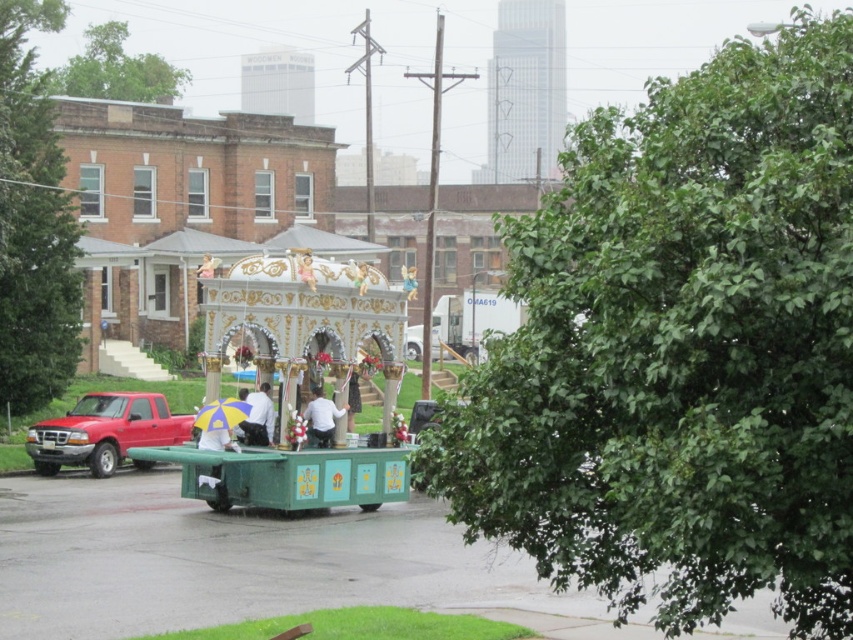
Question: From the image, what is the correct spatial relationship of green leafy tree at left in relation to white matte shirt at center?

Choices:
 (A) below
 (B) above

Answer: (B)

Question: Which of these objects is positioned closest to the gold metallic statue at center?

Choices:
 (A) matte red truck at left
 (B) golden ornate angel at center

Answer: (B)

Question: Among these points, which one is nearest to the camera?

Choices:
 (A) [363, 486]
 (B) [457, 326]

Answer: (A)

Question: Among these objects, which one is nearest to the camera?

Choices:
 (A) white glossy truck at center
 (B) white matte shirt at center
 (C) green painted wood cart at center

Answer: (A)

Question: Is green leafy tree at center below white matte shirt at center?

Choices:
 (A) yes
 (B) no

Answer: (B)

Question: Is green painted wood cart at center further to the viewer compared to gold metallic statue at center?

Choices:
 (A) no
 (B) yes

Answer: (A)